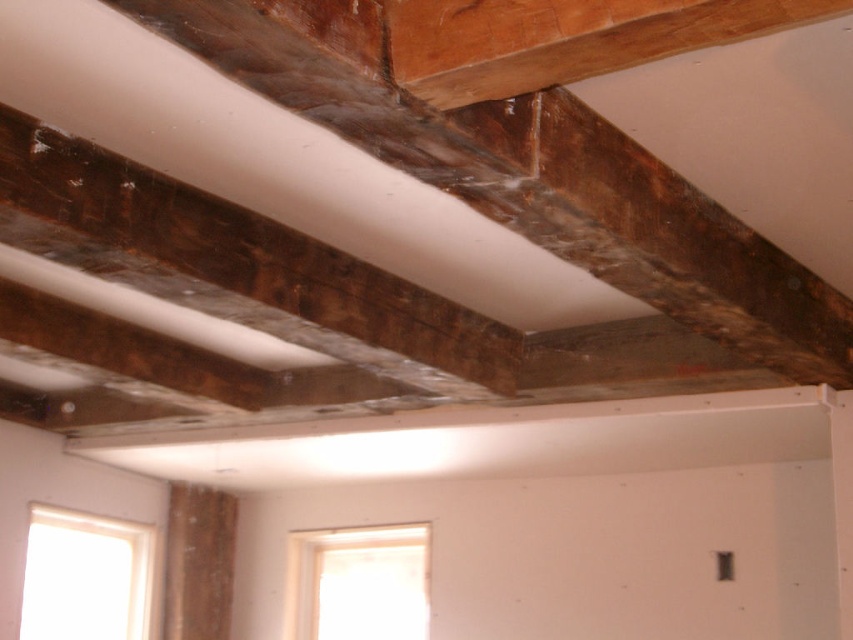
You are holding a 5 feet long ladder and want to place it under the dark brown wood beam at upper center. Can the ladder fit entirely under the beam without touching it?

The dark brown wood beam at upper center and camera are 4.90 feet apart from each other. Since the ladder is 5 feet long, it cannot fit entirely under the beam without touching it because the distance is shorter than the ladder length.

You are a painter standing in the room and need to paint two dark brown wood items at the upper center area. You have a paintbrush that can reach 3 feet. Can you paint both the dark brown wood beam at upper center and the dark brown wood at upper center without moving your position?

The dark brown wood beam at upper center and dark brown wood at upper center are 3.32 feet apart from each other. Since your paintbrush can only reach 3 feet, you cannot paint both without moving your position because the distance between them exceeds the brush length.

You are standing in the room and looking up at the ceiling. There is a point marked at coordinates point (538, 180). Which object does this point correspond to?

The point corresponds to the dark brown wood beam at upper center.